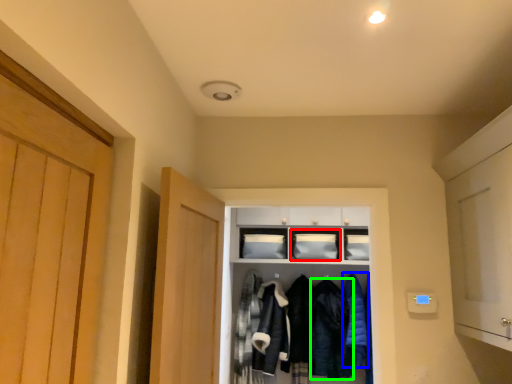
Question: Estimate the real-world distances between objects in this image. Which object is farther from cabinetry (highlighted by a red box), clothing (highlighted by a blue box) or clothing (highlighted by a green box)?

Choices:
 (A) clothing
 (B) clothing

Answer: (B)